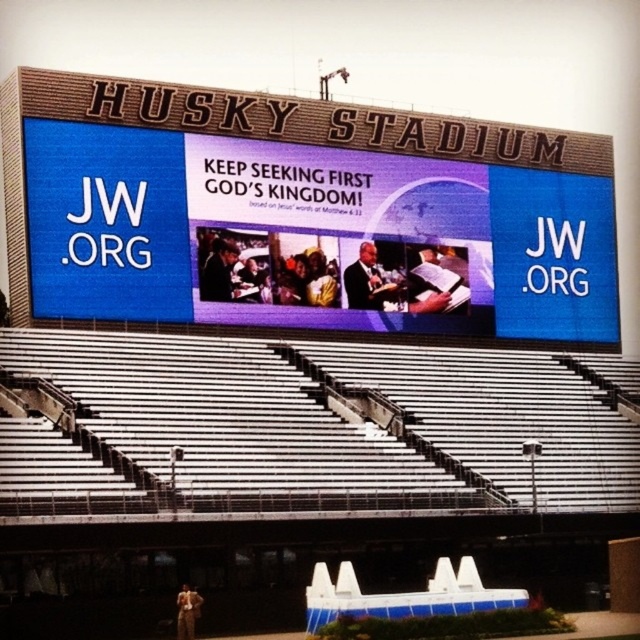
Question: Which object is positioned closest to the dark suit at center?

Choices:
 (A) blue led display at upper center
 (B) matte black suit at center
 (C) metallic silver bleachers at lower center

Answer: (A)

Question: Is blue led display at upper center positioned behind metallic silver bleachers at lower center?

Choices:
 (A) yes
 (B) no

Answer: (A)

Question: Which of the following is the farthest from the observer?

Choices:
 (A) dark suit at center
 (B) blue led display at upper center
 (C) matte black suit at center

Answer: (A)

Question: Which object appears farthest from the camera in this image?

Choices:
 (A) dark suit at center
 (B) matte black suit at center
 (C) blue led display at upper center
 (D) metallic silver bleachers at lower center

Answer: (A)

Question: Where is blue led display at upper center located in relation to matte black suit at center in the image?

Choices:
 (A) right
 (B) left

Answer: (A)

Question: Is metallic silver bleachers at lower center below matte black suit at center?

Choices:
 (A) yes
 (B) no

Answer: (A)